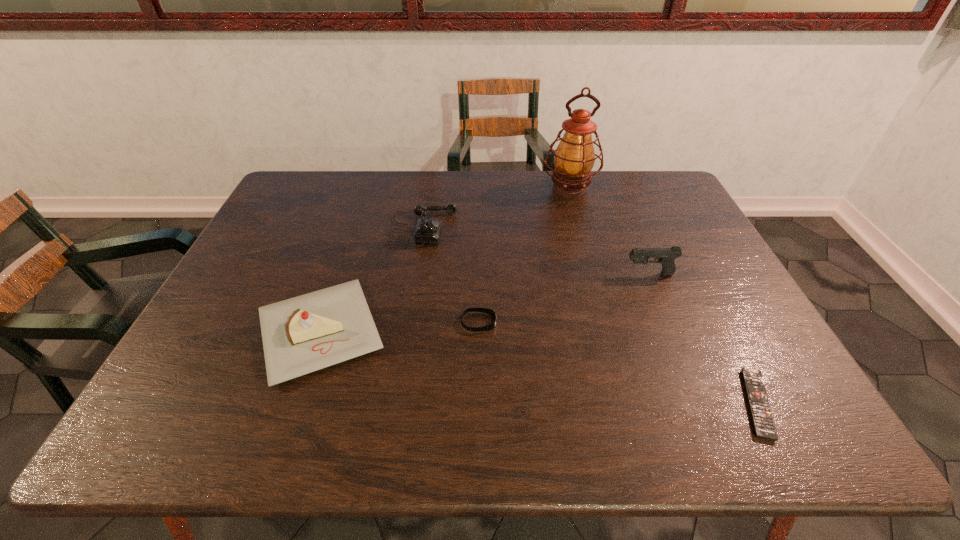
Locate an element on the screen. This screenshot has height=540, width=960. the farthest object is located at coordinates (574, 157).

At what (x,y) coordinates should I click in order to perform the action: click on oil lamp. Please return your answer as a coordinate pair (x, y). This screenshot has width=960, height=540. Looking at the image, I should click on (574, 157).

I want to click on the third farthest object, so click(666, 256).

What are the coordinates of `the second tallest object` in the screenshot? It's located at (666, 256).

Find the location of a particular element. telephone is located at coordinates (428, 230).

Identify the location of cake. Image resolution: width=960 pixels, height=540 pixels. (300, 335).

Where is `wristband`? Image resolution: width=960 pixels, height=540 pixels. wristband is located at coordinates (484, 310).

At what (x,y) coordinates should I click in order to perform the action: click on the third object from left to right. Please return your answer as a coordinate pair (x, y). This screenshot has height=540, width=960. Looking at the image, I should click on (484, 310).

This screenshot has height=540, width=960. Identify the location of the rightmost object. (764, 427).

You are a GUI agent. You are given a task and a screenshot of the screen. Output one action in this format:
    pyautogui.click(x=<x>, y=<y>)
    Task: Click on the shortest object
    This screenshot has height=540, width=960.
    Given the screenshot: What is the action you would take?
    pyautogui.click(x=764, y=427)